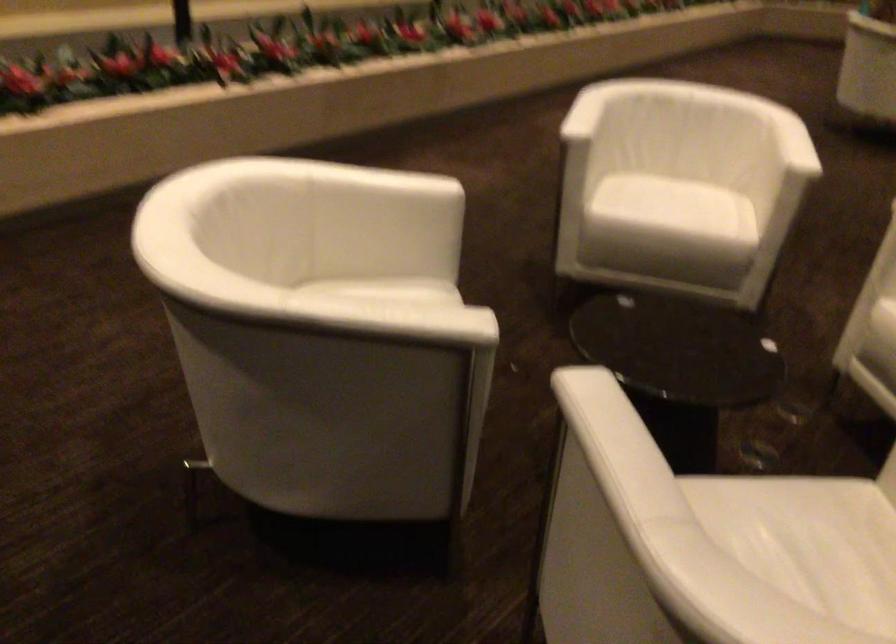
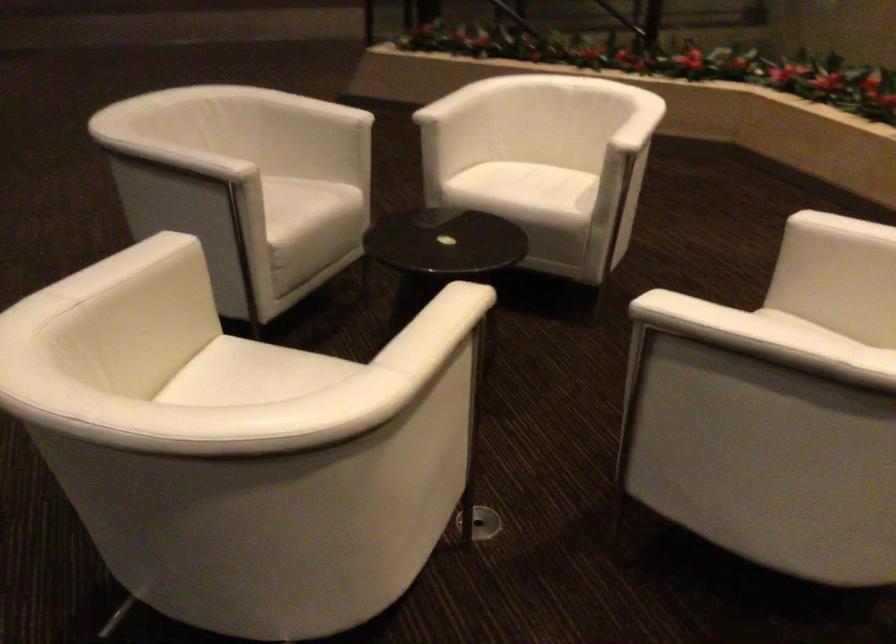
Find the pixel in the second image that matches point 710,485 in the first image.

(306, 205)